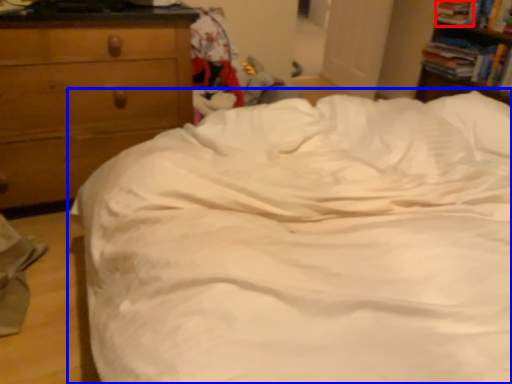
Question: Which of the following is the closest to the observer, book (highlighted by a red box) or bed (highlighted by a blue box)?

Choices:
 (A) book
 (B) bed

Answer: (B)